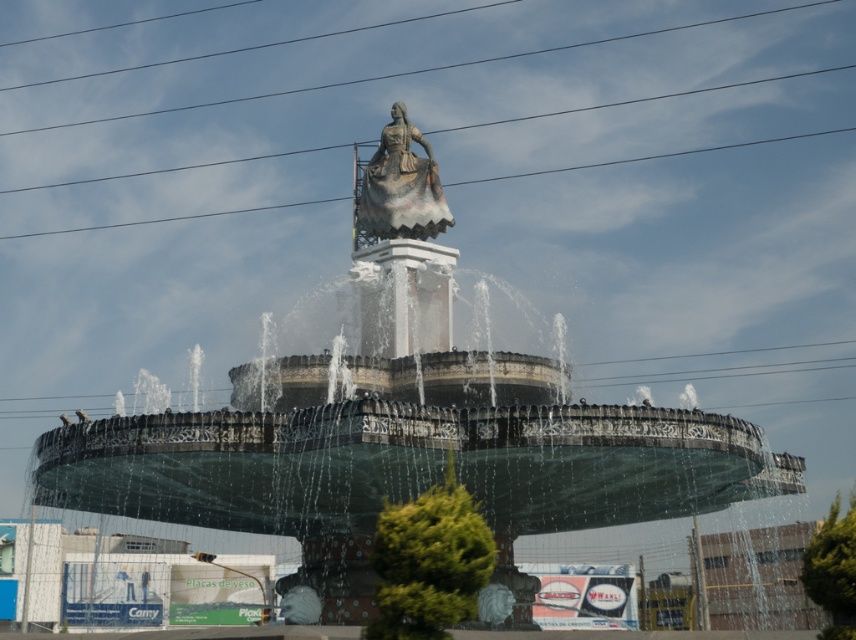
Question: Does metallic wire at upper center lie in front of polished bronze statue at center?

Choices:
 (A) yes
 (B) no

Answer: (B)

Question: Which point is closer to the camera?

Choices:
 (A) polished bronze statue at center
 (B) metallic wire at upper center

Answer: (A)

Question: Among these objects, which one is farthest from the camera?

Choices:
 (A) metallic wire at upper center
 (B) polished bronze statue at center

Answer: (A)

Question: Is metallic wire at upper center to the left of polished bronze statue at center from the viewer's perspective?

Choices:
 (A) yes
 (B) no

Answer: (B)

Question: Is the position of metallic wire at upper center more distant than that of polished bronze statue at center?

Choices:
 (A) no
 (B) yes

Answer: (B)

Question: Among these objects, which one is nearest to the camera?

Choices:
 (A) polished bronze statue at center
 (B) metallic wire at upper center

Answer: (A)